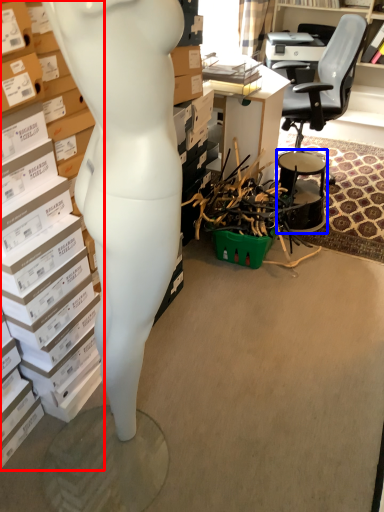
Question: Which of the following is the farthest to the observer, book (highlighted by a red box) or drum (highlighted by a blue box)?

Choices:
 (A) book
 (B) drum

Answer: (B)